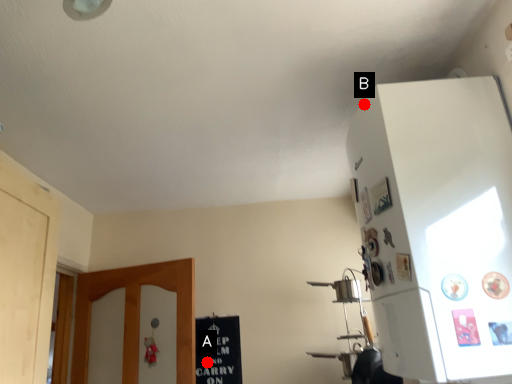
Question: Two points are circled on the image, labeled by A and B beside each circle. Which point is farther to the camera?

Choices:
 (A) A is further
 (B) B is further

Answer: (A)